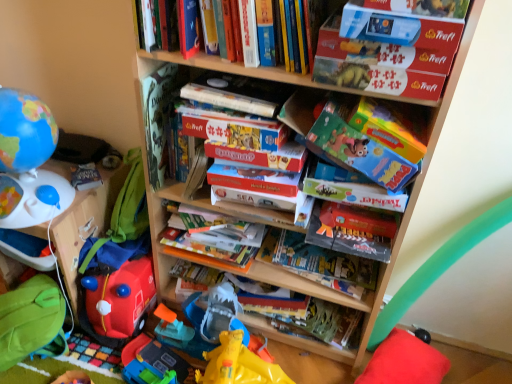
Question: Would you say green fabric bean bag at lower left is inside or outside rubberized red fire truck at lower left, which is counted as the first toy, starting from the right?

Choices:
 (A) inside
 (B) outside

Answer: (B)

Question: Is point (23, 301) positioned closer to the camera than point (123, 326)?

Choices:
 (A) farther
 (B) closer

Answer: (B)

Question: Which is nearer to the hardcover book at upper center, which is the fourth book from bottom to top?

Choices:
 (A) white plastic toy at left
 (B) matte cardboard book at center, which ranks as the 1th paperback book in right-to-left order
 (C) hardcover book at center, which appears as the 2th book when ordered from the bottom
 (D) green fabric bean bag at lower left
 (E) wooden bookcase at center

Answer: (B)

Question: Which object is the farthest from the matte cardboard book at center, which ranks as the second paperback book in left-to-right order?

Choices:
 (A) matte cardboard puzzle box at upper right, the second book positioned from the top
 (B) white plastic toy at left
 (C) green fabric bean bag at lower left
 (D) rubberized red fire truck at lower left, which is counted as the 1th toy, starting from the bottom
 (E) matte plastic globe at left, placed as the 1th toy when sorted from left to right

Answer: (C)